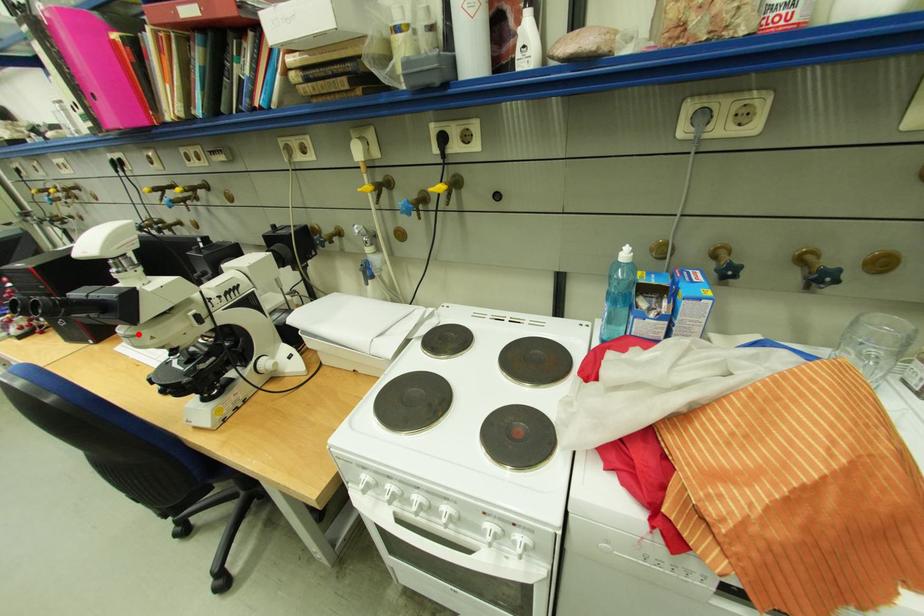
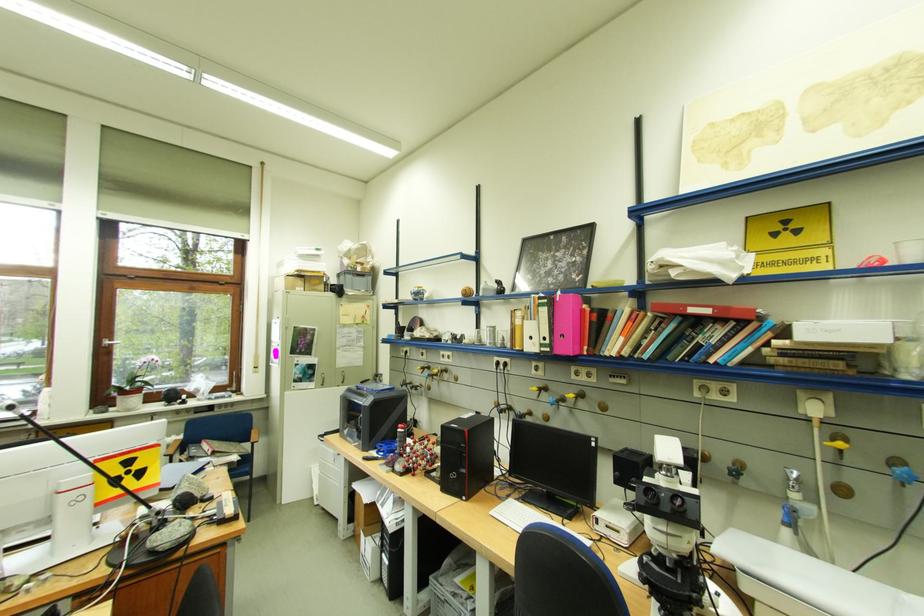
In the second image, find the point that corresponds to the highlighted location in the first image.

(681, 533)